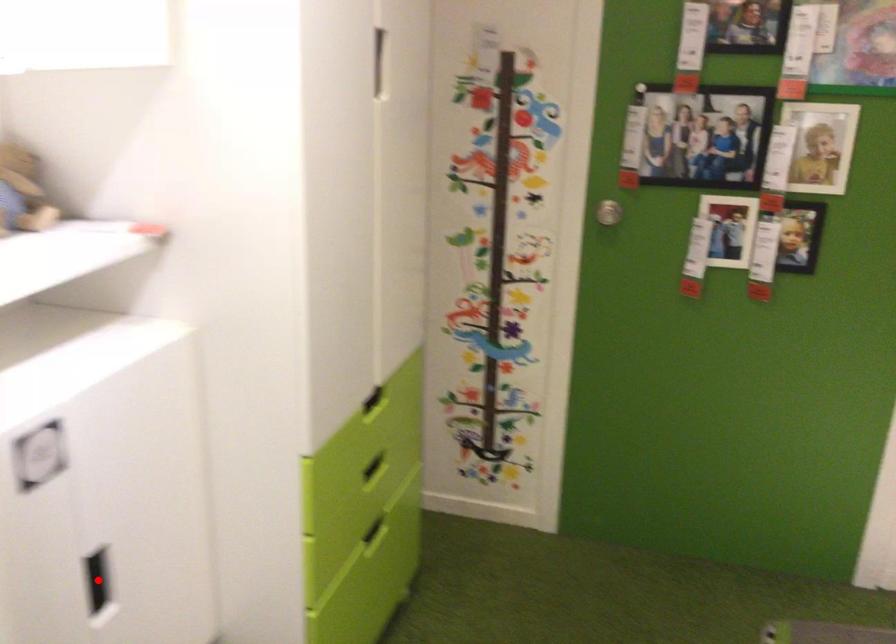
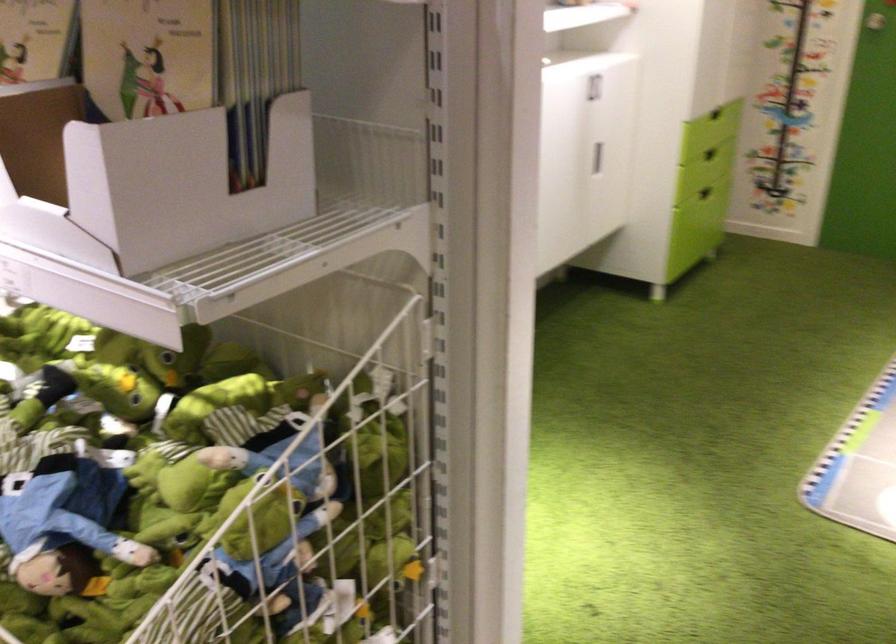
Question: I am providing you with two images of the same scene from different viewpoints. A red point is marked on the first image. At the location where the point appears in image 1, is it still visible in image 2?

Choices:
 (A) Yes
 (B) No

Answer: (B)